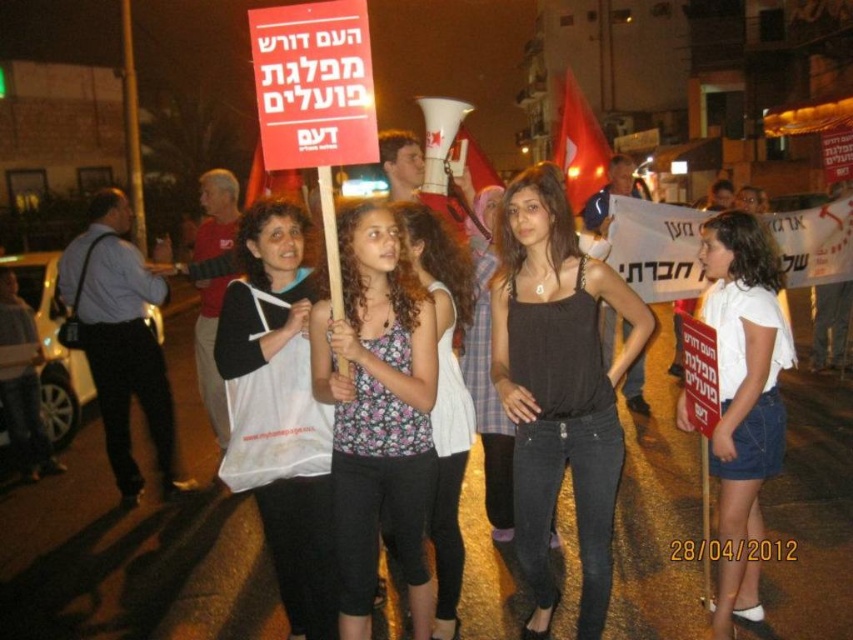
In the scene shown: You are a photographer trying to capture the protest scene. You notice the floral tank top at center and the red sign with white Hebrew text. Which object is positioned closer to the center of the image?

The floral tank top at center is located at point (376, 412), which is closer to the center of the image compared to the red sign with white Hebrew text.

You are a photographer at the protest and want to capture a photo of both the black matte tank top at center and the floral fabric top at center. Which top appears taller in the photo?

The black matte tank top at center appears taller in the photo since it has a greater height compared to the floral fabric top at center.